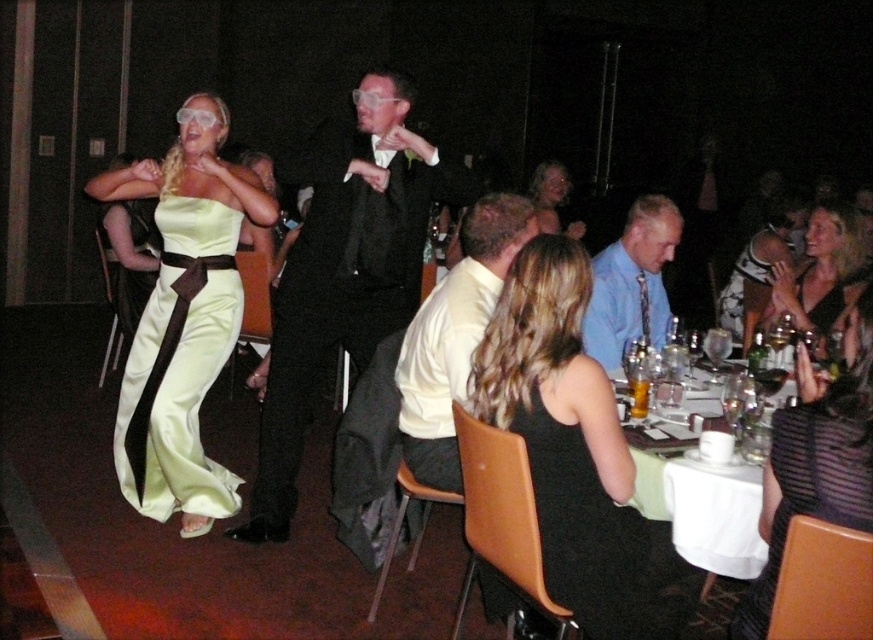
You are organizing a charity event and need to arrange seating based on the width of the attendees. You have two guests wearing the white satin shirt at center and the black satin dress at upper right. Which guest requires a wider seat?

The black satin dress at upper right requires a wider seat because it is thicker than the white satin shirt at center.

Where is the white satin shirt at center located in the image?

The white satin shirt at center is located at point (455, 336).

You are at a formal event and want to take a photo of both the satin dress at left and the white cloth at lower right. Which object is closer to you so you can focus on it first?

The satin dress at left is closer to you than the white cloth at lower right, so you should focus on it first.